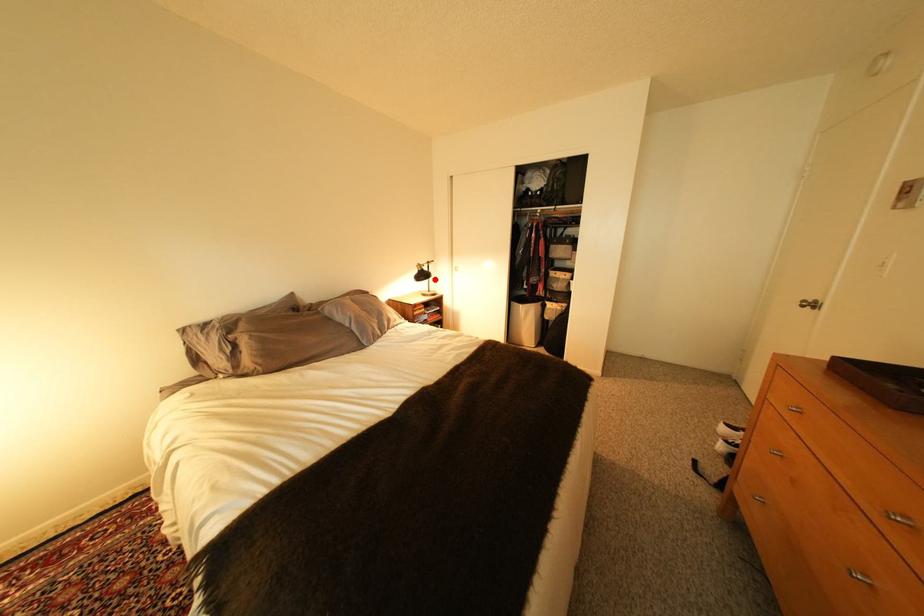
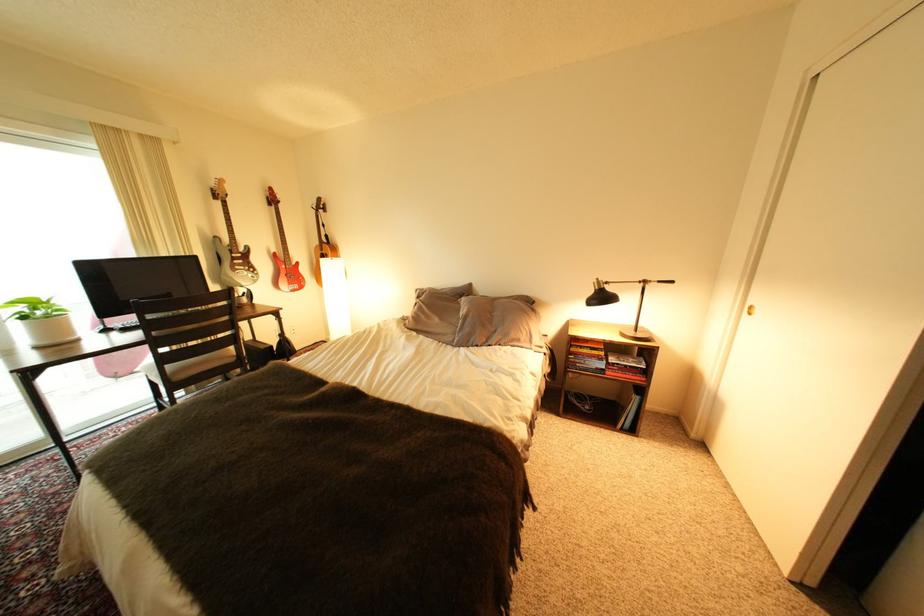
Question: I am providing you with two images of the same scene from different viewpoints. In image1, a red point is highlighted. Considering the same 3D point in image2, which of the following is correct?

Choices:
 (A) It is closer
 (B) It is farther

Answer: (B)